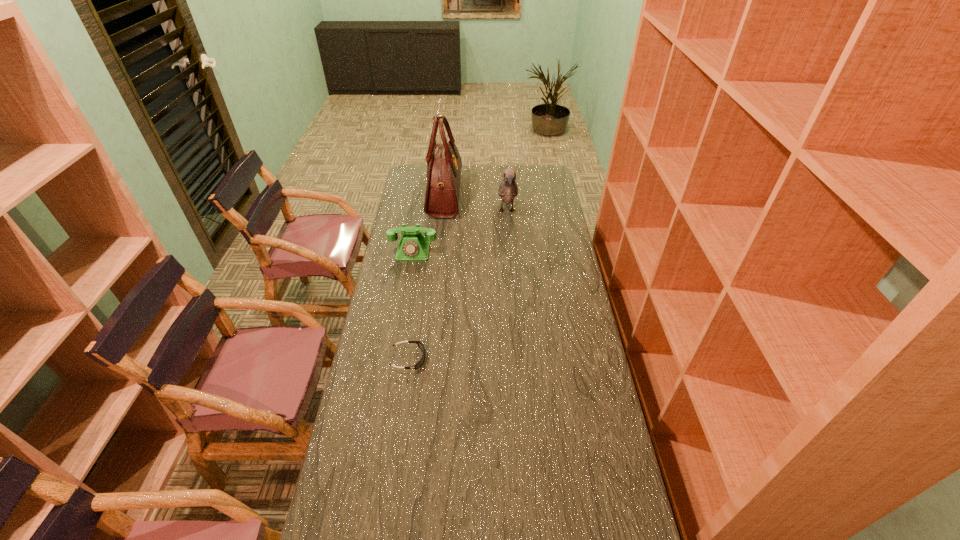
I want to click on free space that satisfies the following two spatial constraints: 1. on the front-facing side of the tallest object; 2. on the dial of the second shortest object, so click(x=439, y=252).

At what (x,y) coordinates should I click in order to perform the action: click on vacant position in the image that satisfies the following two spatial constraints: 1. on the front-facing side of the parrot; 2. on the front and sides of the goggles. Please return your answer as a coordinate pair (x, y). The width and height of the screenshot is (960, 540). Looking at the image, I should click on (518, 359).